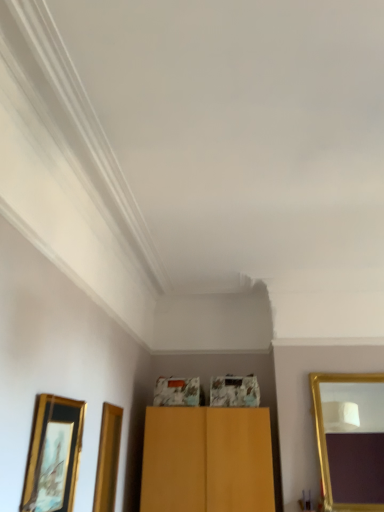
Question: Is gold-framed picture at lower left bigger or smaller than gold-framed mirror at right?

Choices:
 (A) big
 (B) small

Answer: (B)

Question: Based on their positions, is gold-framed picture at lower left located to the left or right of gold-framed mirror at right?

Choices:
 (A) right
 (B) left

Answer: (B)

Question: Considering the positions of gold-framed picture at lower left and gold-framed mirror at right in the image, is gold-framed picture at lower left wider or thinner than gold-framed mirror at right?

Choices:
 (A) thin
 (B) wide

Answer: (A)

Question: From the image's perspective, is gold-framed mirror at right located above or below gold-framed picture at lower left?

Choices:
 (A) below
 (B) above

Answer: (A)

Question: Visually, is gold-framed mirror at right positioned to the left or to the right of gold-framed picture at lower left?

Choices:
 (A) left
 (B) right

Answer: (B)

Question: Is gold-framed mirror at right bigger or smaller than gold-framed picture at lower left?

Choices:
 (A) small
 (B) big

Answer: (B)

Question: Is gold-framed mirror at right in front of or behind gold-framed picture at lower left in the image?

Choices:
 (A) front
 (B) behind

Answer: (B)